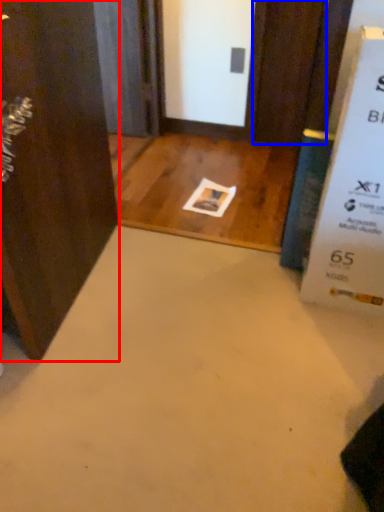
Question: Which of the following is the farthest to the observer, door (highlighted by a red box) or door (highlighted by a blue box)?

Choices:
 (A) door
 (B) door

Answer: (B)